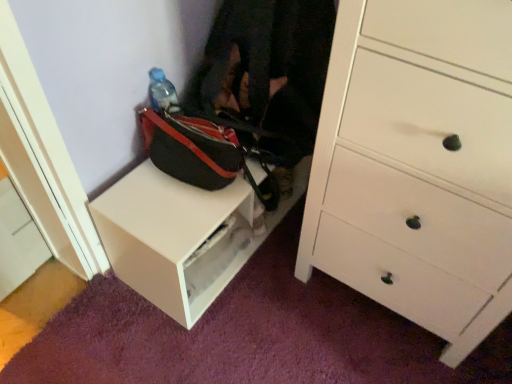
What do you see at coordinates (268, 77) in the screenshot? I see `black fabric bag at center` at bounding box center [268, 77].

Describe the element at coordinates (182, 236) in the screenshot. The width and height of the screenshot is (512, 384). I see `white matte table at lower left` at that location.

This screenshot has width=512, height=384. Find the location of `black fabric bag at center`. black fabric bag at center is located at coordinates (268, 77).

Considering the positions of points (303, 130) and (170, 258), is point (303, 130) closer to camera compared to point (170, 258)?

That is False.

Which object is closer to the camera, black fabric bag at center or white matte table at lower left?

Positioned in front is black fabric bag at center.

In the image, there is a black fabric bag at center. Where is `table below it (from the image's perspective)`? table below it (from the image's perspective) is located at coordinates (182, 236).

Does white wood chest of drawers at center right turn towards black fabric bag at center?

No.

Does white wood chest of drawers at center right have a smaller size compared to black fabric bag at center?

No, white wood chest of drawers at center right is not smaller than black fabric bag at center.

Which point is more forward, [411,115] or [293,106]?

The point [411,115] is more forward.

Is white wood chest of drawers at center right completely or partially outside of black fabric bag at center?

white wood chest of drawers at center right is positioned outside black fabric bag at center.

Considering the sizes of objects white matte table at lower left and black fabric bag at center in the image provided, who is bigger, white matte table at lower left or black fabric bag at center?

white matte table at lower left.

How far apart are white matte table at lower left and black fabric bag at center?

A distance of 30.36 centimeters exists between white matte table at lower left and black fabric bag at center.

Is white matte table at lower left far from black fabric bag at center?

No, white matte table at lower left is in close proximity to black fabric bag at center.

Considering the relative sizes of white matte table at lower left and black fabric bag at center in the image provided, is white matte table at lower left thinner than black fabric bag at center?

Indeed, white matte table at lower left has a lesser width compared to black fabric bag at center.

The image size is (512, 384). I want to click on chest of drawers lying on the right of white matte table at lower left, so click(417, 164).

Choose the correct answer: Is white wood chest of drawers at center right inside white matte table at lower left or outside it?

white wood chest of drawers at center right is outside white matte table at lower left.

Is white wood chest of drawers at center right not close to white matte table at lower left?

That's not correct — white wood chest of drawers at center right is a little close to white matte table at lower left.

How many degrees apart are the facing directions of black fabric bag at center and white wood chest of drawers at center right?

There is a 91.9-degree angle between the facing directions of black fabric bag at center and white wood chest of drawers at center right.

Considering the sizes of objects black fabric bag at center and white wood chest of drawers at center right in the image provided, who is shorter, black fabric bag at center or white wood chest of drawers at center right?

black fabric bag at center is shorter.

Is black fabric bag at center oriented away from white wood chest of drawers at center right?

No, black fabric bag at center is not facing the opposite direction of white wood chest of drawers at center right.

Does point (226, 55) come behind point (447, 158)?

Yes, point (226, 55) is farther from viewer.

From a real-world perspective, who is located higher, white matte table at lower left or white wood chest of drawers at center right?

white wood chest of drawers at center right, from a real-world perspective.

You are a GUI agent. You are given a task and a screenshot of the screen. Output one action in this format:
    pyautogui.click(x=<x>, y=<y>)
    Task: Click on the table below the white wood chest of drawers at center right (from the image's perspective)
    
    Given the screenshot: What is the action you would take?
    pyautogui.click(x=182, y=236)

Considering the points (145, 265) and (347, 156), which point is in front, point (145, 265) or point (347, 156)?

Point (347, 156)

Looking at their sizes, would you say white matte table at lower left is wider or thinner than white wood chest of drawers at center right?

white matte table at lower left is thinner than white wood chest of drawers at center right.

At what (x,y) coordinates should I click in order to perform the action: click on table below the black fabric bag at center (from the image's perspective). Please return your answer as a coordinate pair (x, y). Looking at the image, I should click on (182, 236).

Where is `clothing on the left of white wood chest of drawers at center right`? clothing on the left of white wood chest of drawers at center right is located at coordinates (268, 77).

When comparing their distances from white wood chest of drawers at center right, does white matte table at lower left or black fabric bag at center seem closer?

black fabric bag at center is positioned closer to the anchor white wood chest of drawers at center right.

When comparing their distances from black fabric bag at center, does white matte table at lower left or white wood chest of drawers at center right seem closer?

white matte table at lower left is positioned closer to the anchor black fabric bag at center.

Looking at the image, which one is located further to black fabric bag at center, white wood chest of drawers at center right or white matte table at lower left?

The object further to black fabric bag at center is white wood chest of drawers at center right.

Based on their spatial positions, is black fabric bag at center or white wood chest of drawers at center right further from white matte table at lower left?

white wood chest of drawers at center right is positioned further to the anchor white matte table at lower left.

Considering their positions, is black fabric bag at center positioned closer to white wood chest of drawers at center right than white matte table at lower left?

black fabric bag at center.

Considering their positions, is white wood chest of drawers at center right positioned closer to white matte table at lower left than black fabric bag at center?

black fabric bag at center lies closer to white matte table at lower left than the other object.

Find the location of a particular element. The height and width of the screenshot is (384, 512). clothing situated between white matte table at lower left and white wood chest of drawers at center right from left to right is located at coordinates (268, 77).